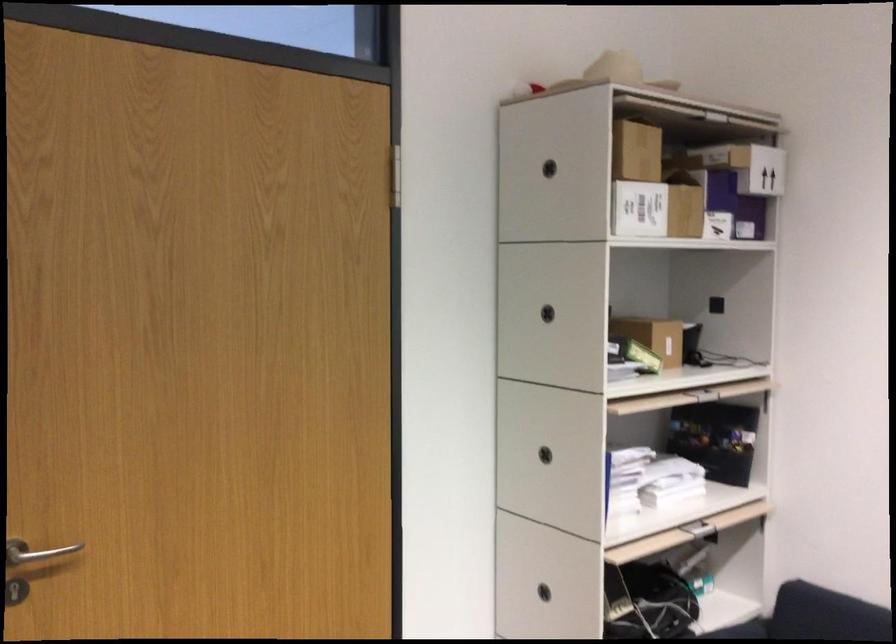
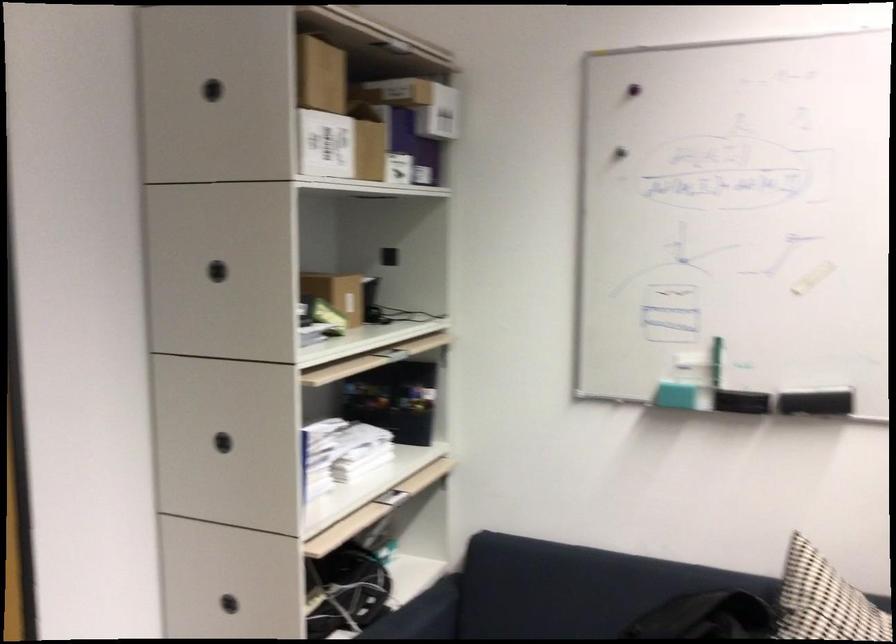
Locate, in the second image, the point that corresponds to point (547, 166) in the first image.

(211, 90)